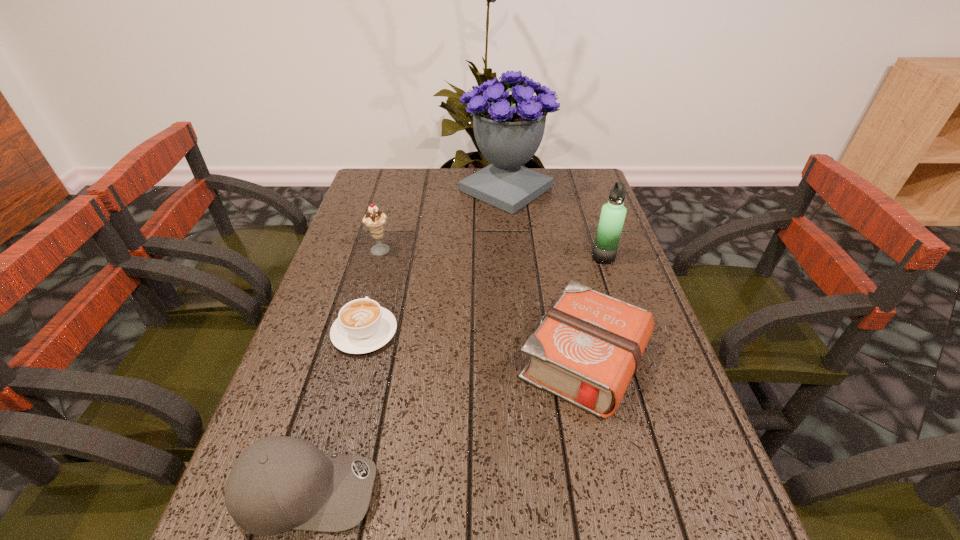
Find the location of a particular element. The height and width of the screenshot is (540, 960). free point between the tallest object and the cappuccino is located at coordinates (436, 261).

I want to click on vacant space that is in between the thermos bottle and the cappuccino, so click(484, 295).

Where is `free point between the Bible and the baseball cap`? This screenshot has height=540, width=960. free point between the Bible and the baseball cap is located at coordinates (445, 425).

You are a GUI agent. You are given a task and a screenshot of the screen. Output one action in this format:
    pyautogui.click(x=<x>, y=<y>)
    Task: Click on the empty location between the nearest object and the thermos bottle
    
    Given the screenshot: What is the action you would take?
    pyautogui.click(x=455, y=374)

The height and width of the screenshot is (540, 960). Identify the location of empty location between the Bible and the bouquet. (545, 275).

What are the coordinates of `unoccupied area between the shortest object and the second tallest object` in the screenshot? It's located at (484, 295).

Where is `free space between the baseball cap and the icecream`? free space between the baseball cap and the icecream is located at coordinates (343, 371).

Select which object is the fifth closest to the thermos bottle. Please provide its 2D coordinates. Your answer should be formatted as a tuple, i.e. [(x, y)], where the tuple contains the x and y coordinates of a point satisfying the conditions above.

[(279, 483)]

Find the location of a particular element. This screenshot has width=960, height=540. object identified as the second closest to the cappuccino is located at coordinates pos(279,483).

I want to click on vacant point that satisfies the following two spatial constraints: 1. on the front side of the farthest object; 2. on the front brim of the nearest object, so click(533, 490).